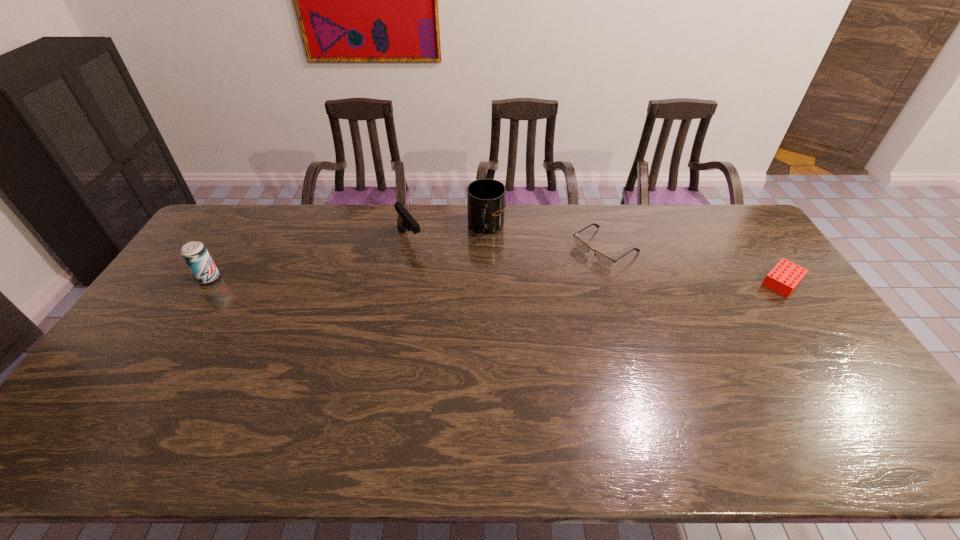
Where is `object that is positioned at the left edge`? Image resolution: width=960 pixels, height=540 pixels. object that is positioned at the left edge is located at coordinates pos(195,254).

The height and width of the screenshot is (540, 960). I want to click on object that is at the right edge, so click(785, 276).

Where is `vacant space at the far edge`? This screenshot has height=540, width=960. vacant space at the far edge is located at coordinates (673, 213).

In the image, there is a desktop. At what (x,y) coordinates should I click in order to perform the action: click on blank space at the near edge. Please return your answer as a coordinate pair (x, y). This screenshot has height=540, width=960. Looking at the image, I should click on (448, 389).

You are a GUI agent. You are given a task and a screenshot of the screen. Output one action in this format:
    pyautogui.click(x=<x>, y=<y>)
    Task: Click on the free space at the left edge of the desktop
    The image size is (960, 540).
    Given the screenshot: What is the action you would take?
    pyautogui.click(x=199, y=308)

Find the location of `vacant space at the right edge of the desktop`. vacant space at the right edge of the desktop is located at coordinates (836, 352).

Identify the location of vacant region at the far left corner. (253, 221).

Locate an element on the screen. The width and height of the screenshot is (960, 540). empty space between the second object from left to right and the spectacles is located at coordinates (508, 244).

This screenshot has height=540, width=960. Find the location of `free space between the mug and the rightmost object`. free space between the mug and the rightmost object is located at coordinates (635, 254).

You are a GUI agent. You are given a task and a screenshot of the screen. Output one action in this format:
    pyautogui.click(x=<x>, y=<y>)
    Task: Click on the vacant region between the spectacles and the fourth object from right to left
    This screenshot has height=540, width=960.
    Given the screenshot: What is the action you would take?
    pyautogui.click(x=508, y=244)